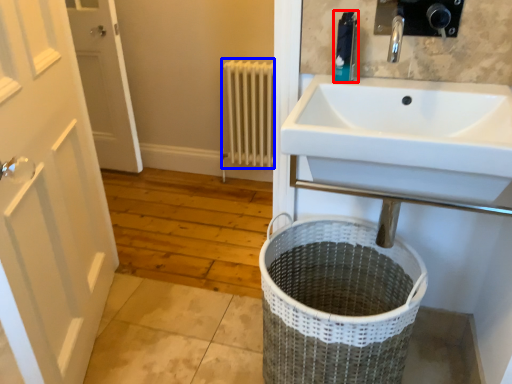
Question: Which object appears closest to the camera in this image, toiletry (highlighted by a red box) or radiator (highlighted by a blue box)?

Choices:
 (A) toiletry
 (B) radiator

Answer: (A)